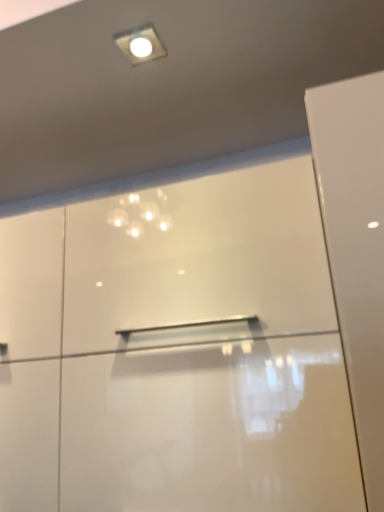
Question: Looking at the image, does white glossy droplight at upper center seem bigger or smaller compared to glossy white dresser at center?

Choices:
 (A) big
 (B) small

Answer: (B)

Question: Is point (148, 56) positioned closer to the camera than point (170, 278)?

Choices:
 (A) closer
 (B) farther

Answer: (A)

Question: From a real-world perspective, relative to glossy white dresser at center, is white glossy droplight at upper center vertically above or below?

Choices:
 (A) below
 (B) above

Answer: (B)

Question: In the image, is glossy white dresser at center positioned in front of or behind white glossy droplight at upper center?

Choices:
 (A) behind
 (B) front

Answer: (B)

Question: Which is correct: glossy white dresser at center is inside white glossy droplight at upper center, or outside of it?

Choices:
 (A) inside
 (B) outside

Answer: (B)

Question: In terms of width, does glossy white dresser at center look wider or thinner when compared to white glossy droplight at upper center?

Choices:
 (A) thin
 (B) wide

Answer: (B)

Question: Visually, is glossy white dresser at center positioned to the left or to the right of white glossy droplight at upper center?

Choices:
 (A) right
 (B) left

Answer: (B)